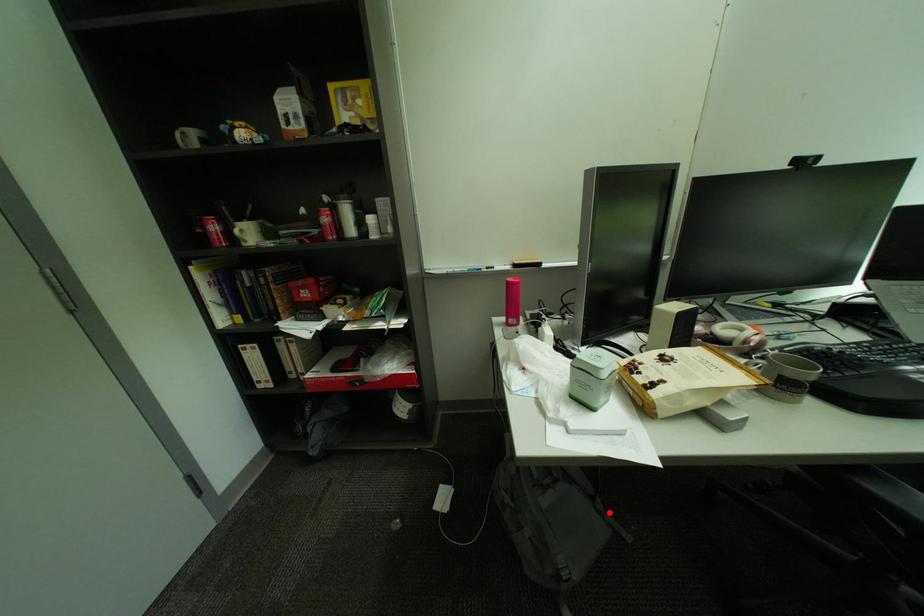
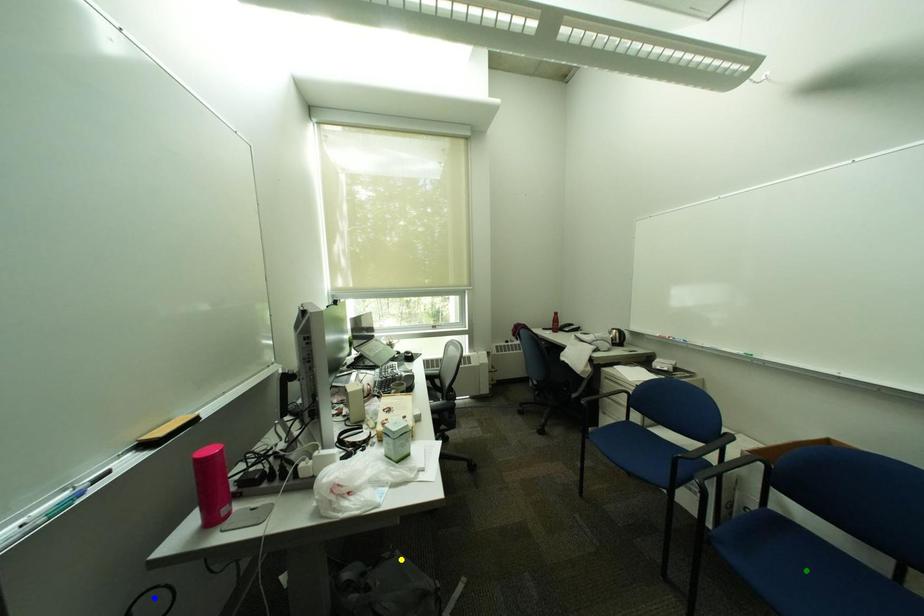
Question: I am providing you with two images of the same scene from different viewpoints. A red point is marked on the first image. You are given multiple points on the second image. In image 2, which mark is for the same physical point as the one in image 1?

Choices:
 (A) blue point
 (B) yellow point
 (C) green point

Answer: (B)